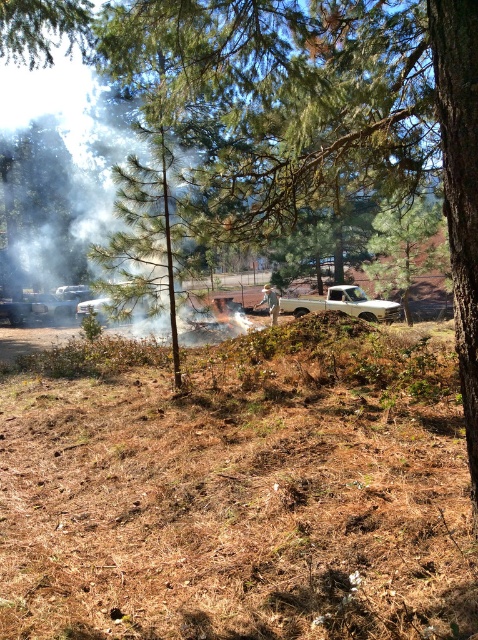
Which is below, white smoke at center or green leafy tree at upper left?

green leafy tree at upper left is lower down.

Between point (97, 163) and point (82, 35), which one is positioned behind?

The point (97, 163) is behind.

The height and width of the screenshot is (640, 478). In order to click on white smoke at center in this screenshot , I will do `click(61, 168)`.

Does green leafy tree at upper left appear under brushed metal car at lower left?

No, green leafy tree at upper left is not below brushed metal car at lower left.

Does green leafy tree at upper left have a larger size compared to brushed metal car at lower left?

No, green leafy tree at upper left is not bigger than brushed metal car at lower left.

Locate an element on the screen. Image resolution: width=478 pixels, height=640 pixels. green leafy tree at upper left is located at coordinates (43, 29).

The height and width of the screenshot is (640, 478). I want to click on white smoke at center, so click(61, 168).

Is white smoke at center in front of brushed metal car at lower left?

Yes, it is in front of brushed metal car at lower left.

Where is `white smoke at center`? The height and width of the screenshot is (640, 478). white smoke at center is located at coordinates (61, 168).